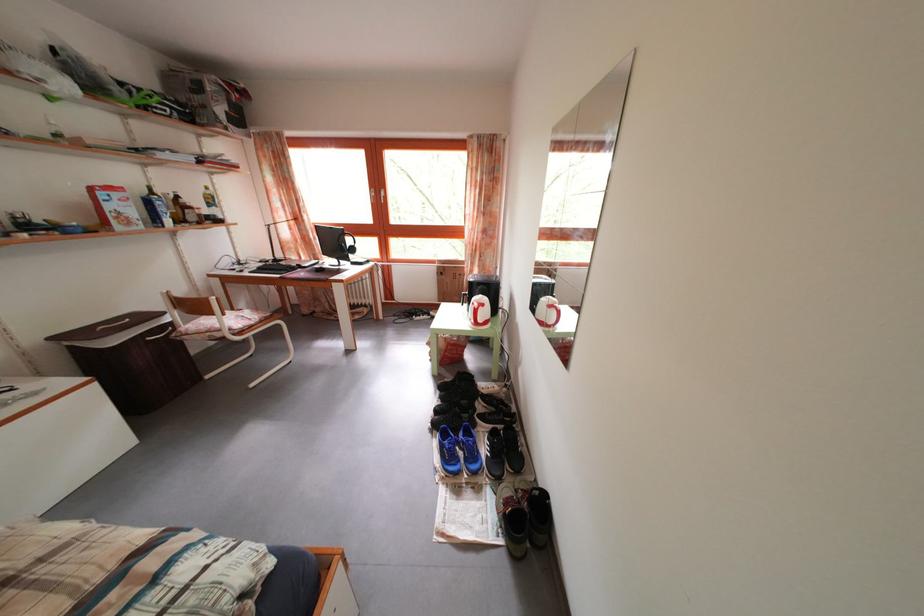
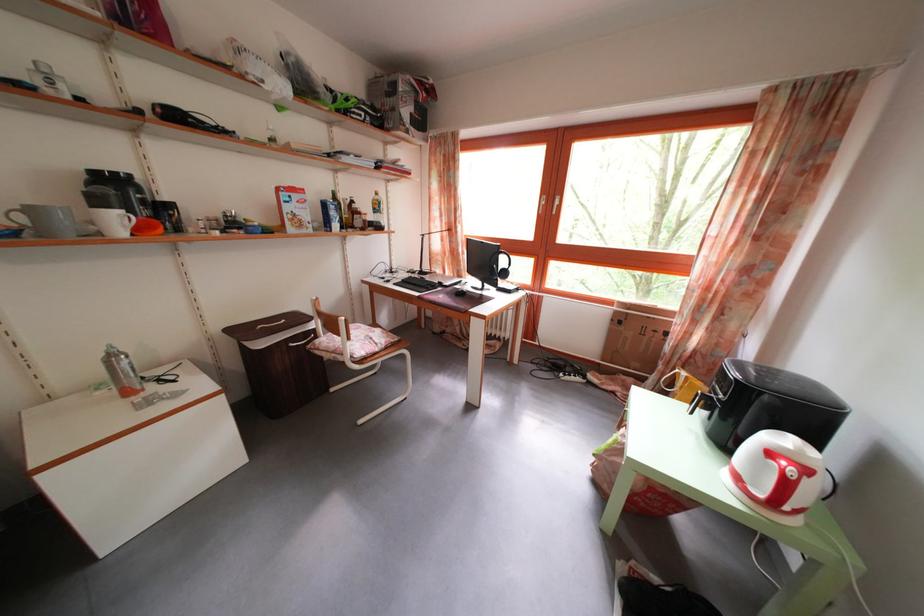
Question: The images are taken continuously from a first-person perspective. In which direction is your viewpoint rotating?

Choices:
 (A) Left
 (B) Right
 (C) Up
 (D) Down

Answer: (A)